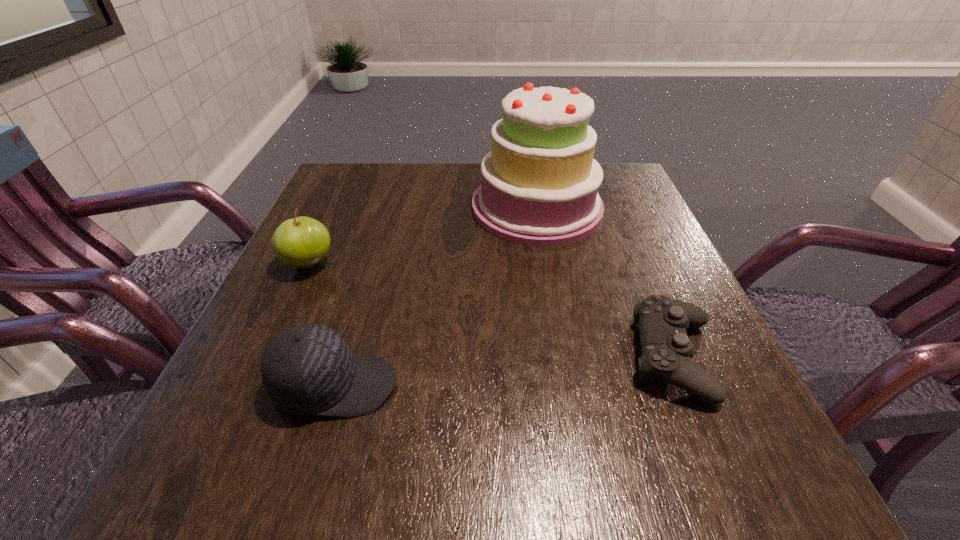
Identify the location of vacant region at the far right corner of the desktop. This screenshot has width=960, height=540. (627, 183).

The image size is (960, 540). Identify the location of free location at the near right corner. (702, 451).

At what (x,y) coordinates should I click in order to perform the action: click on vacant area between the control and the cake. Please return your answer as a coordinate pair (x, y). Image resolution: width=960 pixels, height=540 pixels. Looking at the image, I should click on (606, 283).

Locate an element on the screen. Image resolution: width=960 pixels, height=540 pixels. vacant area that lies between the apple and the baseball cap is located at coordinates (322, 325).

The width and height of the screenshot is (960, 540). I want to click on vacant point located between the second farthest object and the cake, so click(x=422, y=236).

This screenshot has width=960, height=540. Find the location of `free spot between the baseball cap and the control`. free spot between the baseball cap and the control is located at coordinates (505, 372).

Where is `free space between the cake and the apple`? The height and width of the screenshot is (540, 960). free space between the cake and the apple is located at coordinates (422, 236).

The image size is (960, 540). What are the coordinates of `vacant region between the shortest object and the farthest object` in the screenshot? It's located at (606, 283).

The height and width of the screenshot is (540, 960). In order to click on free spot between the shortest object and the tallest object in this screenshot , I will do `click(606, 283)`.

Find the location of a particular element. unoccupied position between the baseball cap and the apple is located at coordinates (322, 325).